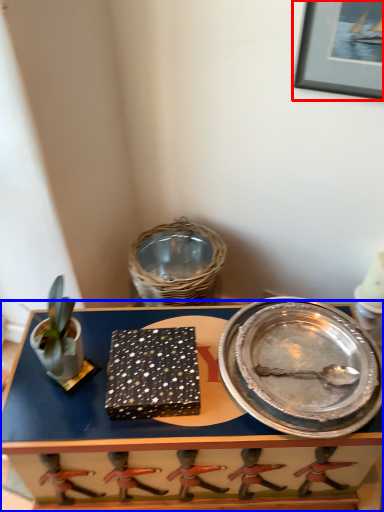
Question: Which of the following is the farthest to the observer, picture frame (highlighted by a red box) or table (highlighted by a blue box)?

Choices:
 (A) picture frame
 (B) table

Answer: (B)